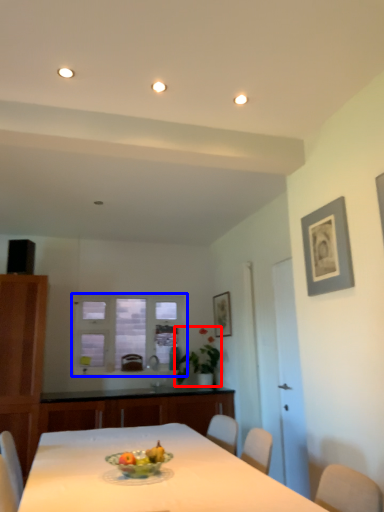
Question: Which point is further to the camera, plant (highlighted by a red box) or window (highlighted by a blue box)?

Choices:
 (A) plant
 (B) window

Answer: (B)